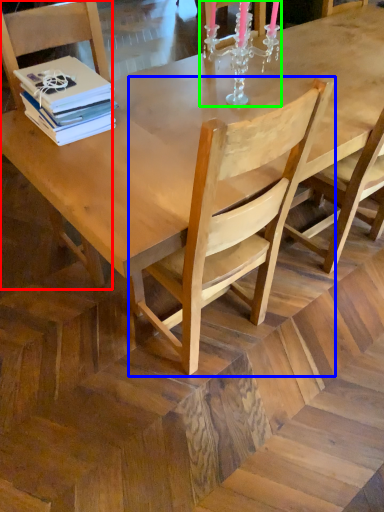
Question: Which is farther away from chair (highlighted by a red box)? chair (highlighted by a blue box) or candle holder (highlighted by a green box)?

Choices:
 (A) chair
 (B) candle holder

Answer: (A)